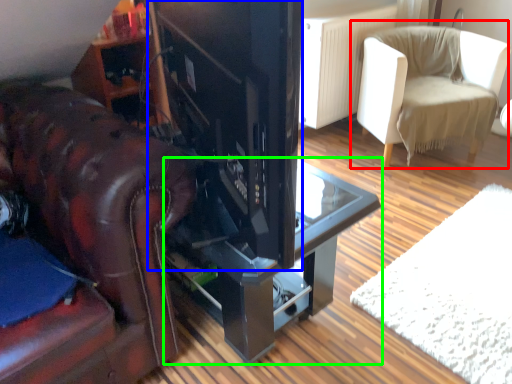
Question: Based on their relative distances, which object is nearer to chair (highlighted by a red box)? Choose from appliance (highlighted by a blue box) and table (highlighted by a green box).

Choices:
 (A) appliance
 (B) table

Answer: (B)